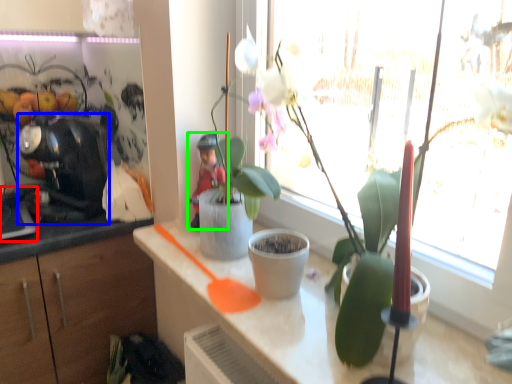
Question: Considering the real-world distances, which object is farthest from appliance (highlighted by a red box)? coffee machine (highlighted by a blue box) or person (highlighted by a green box)?

Choices:
 (A) coffee machine
 (B) person

Answer: (B)